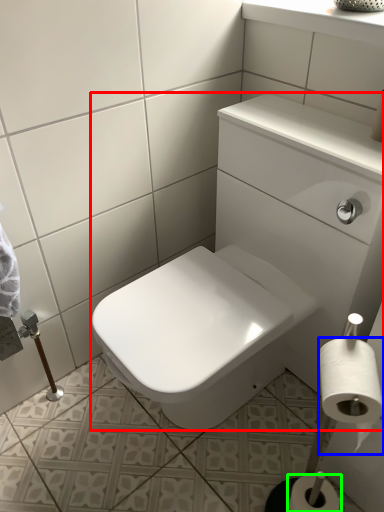
Question: Based on their relative distances, which object is farther from sink (highlighted by a red box)? Choose from toilet paper (highlighted by a blue box) and toilet paper (highlighted by a green box).

Choices:
 (A) toilet paper
 (B) toilet paper

Answer: (B)